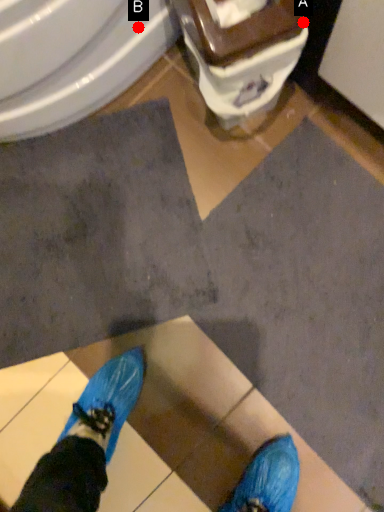
Question: Two points are circled on the image, labeled by A and B beside each circle. Among these points, which one is nearest to the camera?

Choices:
 (A) A is closer
 (B) B is closer

Answer: (A)